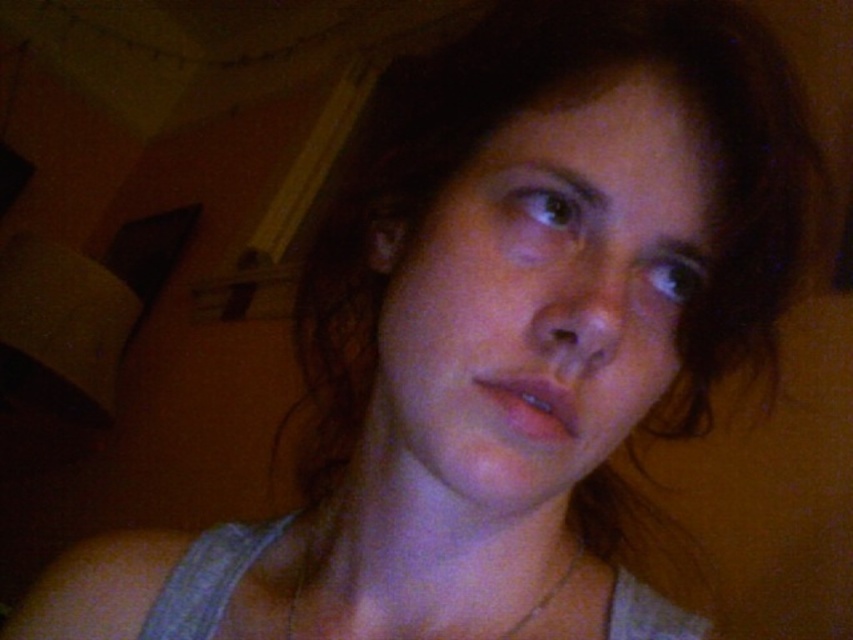
Does smooth skin face at center have a greater width compared to silver metallic chain at center?

No.

Does smooth skin face at center appear on the right side of silver metallic chain at center?

Indeed, smooth skin face at center is positioned on the right side of silver metallic chain at center.

Between point (421, 289) and point (305, 541), which one is positioned in front?

Point (421, 289) is in front.

This screenshot has width=853, height=640. Identify the location of smooth skin face at center. (538, 300).